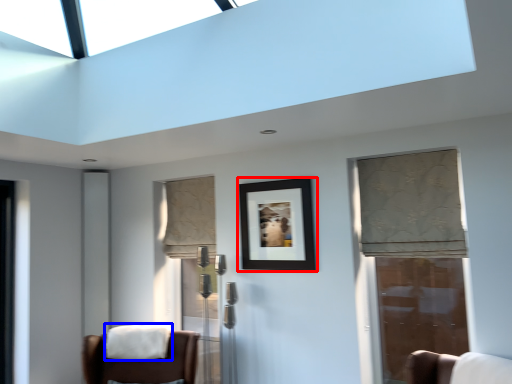
Question: Which point is closer to the camera, picture frame (highlighted by a red box) or blanket (highlighted by a blue box)?

Choices:
 (A) picture frame
 (B) blanket

Answer: (A)